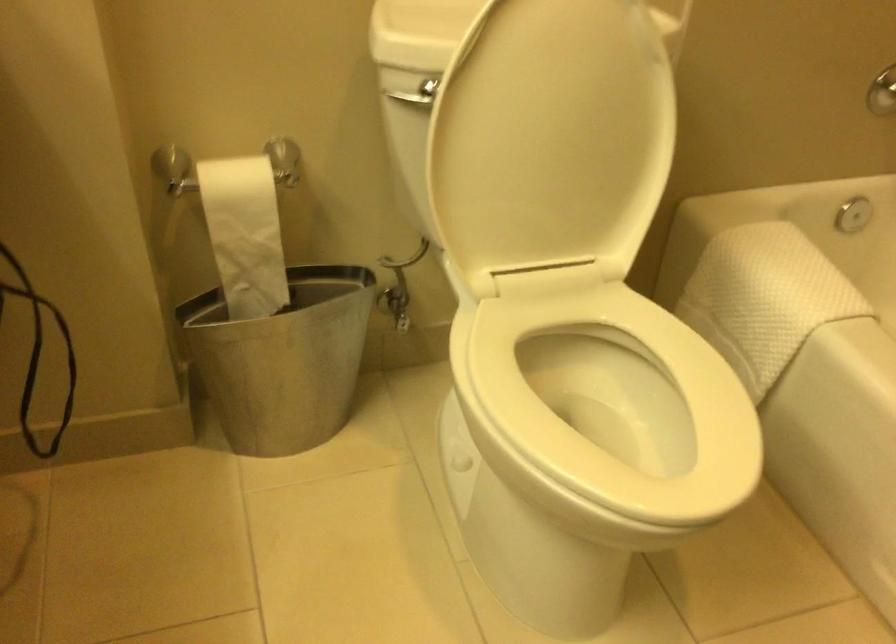
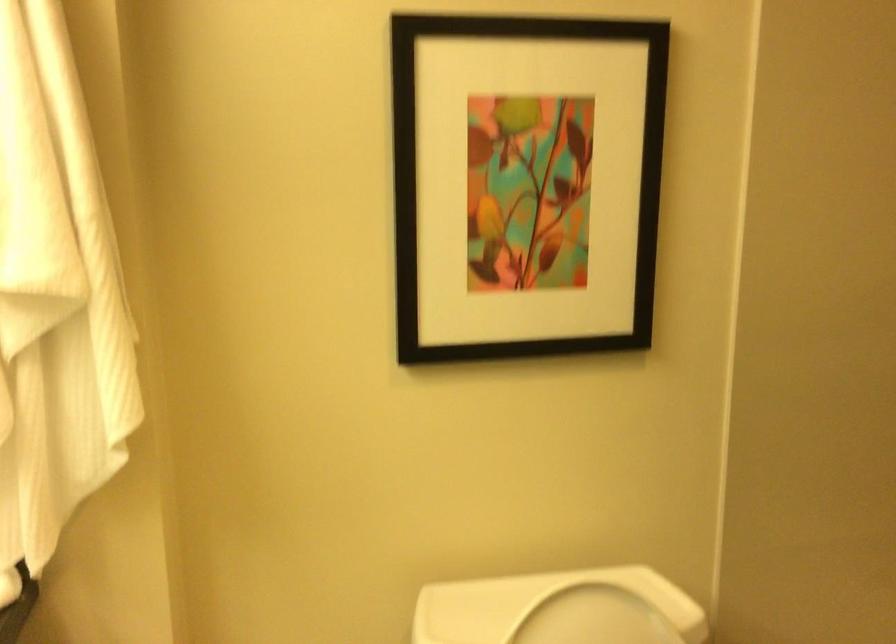
Question: The images are taken continuously from a first-person perspective. In which direction is your viewpoint rotating?

Choices:
 (A) Left
 (B) Right
 (C) Up
 (D) Down

Answer: (C)